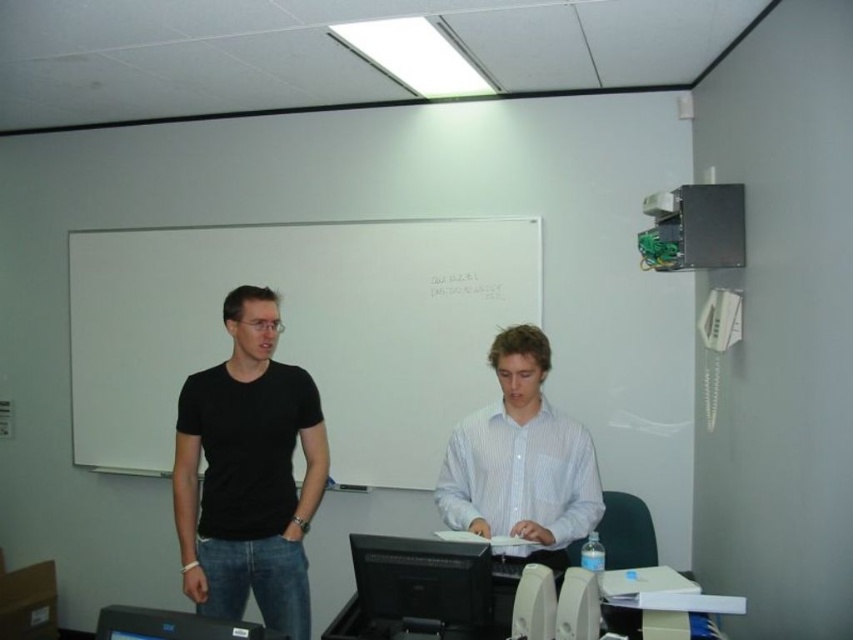
Which of these two, white striped shirt at center or white plastic printer at lower center, stands shorter?

Standing shorter between the two is white plastic printer at lower center.

Who is higher up, white striped shirt at center or white plastic printer at lower center?

white striped shirt at center is higher up.

What do you see at coordinates (521, 460) in the screenshot?
I see `white striped shirt at center` at bounding box center [521, 460].

This screenshot has width=853, height=640. Identify the location of white striped shirt at center. (521, 460).

Is point (466, 545) positioned behind point (648, 609)?

No, it is in front of (648, 609).

Can you confirm if black glossy monitor at center is positioned above white plastic printer at lower center?

Indeed, black glossy monitor at center is positioned over white plastic printer at lower center.

Does point (474, 556) lie in front of point (650, 620)?

Yes, it is.

Where is `black glossy monitor at center`? The image size is (853, 640). black glossy monitor at center is located at coordinates 422,579.

Does white matte whiteboard at upper center have a smaller size compared to black matte t-shirt at left?

Actually, white matte whiteboard at upper center might be larger than black matte t-shirt at left.

Image resolution: width=853 pixels, height=640 pixels. In order to click on white matte whiteboard at upper center in this screenshot , I will do `click(299, 330)`.

Between point (380, 276) and point (305, 620), which one is positioned in front?

Positioned in front is point (305, 620).

The height and width of the screenshot is (640, 853). In order to click on white matte whiteboard at upper center in this screenshot , I will do `click(299, 330)`.